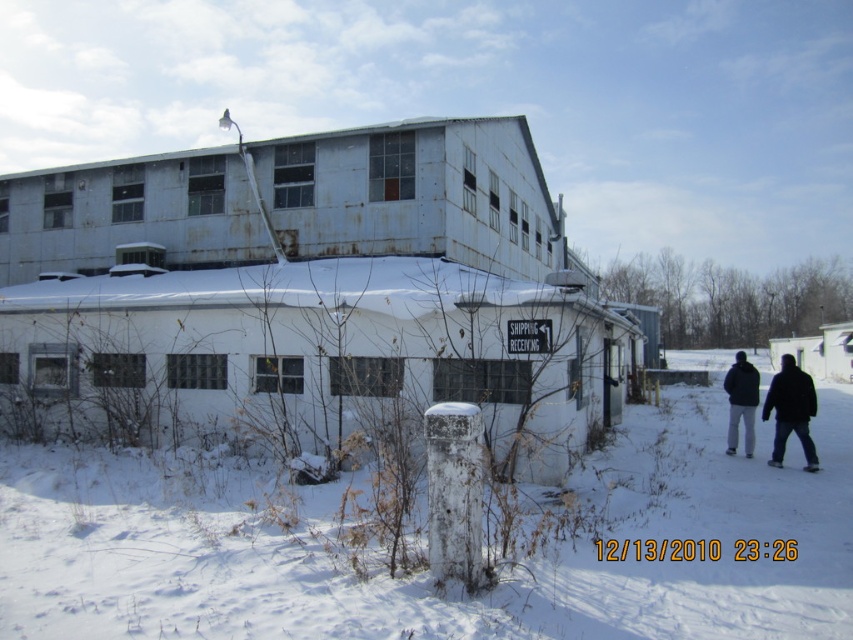
You are standing in the snowy outdoor scene and want to walk from the white powdery snow at center to the dark gray jacket at lower right. Which direction should you move to reach the jacket?

You should move backward because the white powdery snow at center is in front of the dark gray jacket at lower right, meaning the jacket is behind you relative to your current position.

In the scene shown: You are standing at the edge of the snowy area in the image and want to walk to the white building with a flat roof. You see the white powdery snow at center and the dark gray jacket at lower right. Which object is closer to your current position?

The white powdery snow at center is closer to your current position because it is below the dark gray jacket at lower right, meaning it is located in a lower position relative to the jacket.

You are standing in the snowy outdoor scene and want to walk towards the two points marked in the image. Which point, point (457,612) or point (732,432), will you reach first?

You will reach point (457,612) first because it is closer to you than point (732,432).